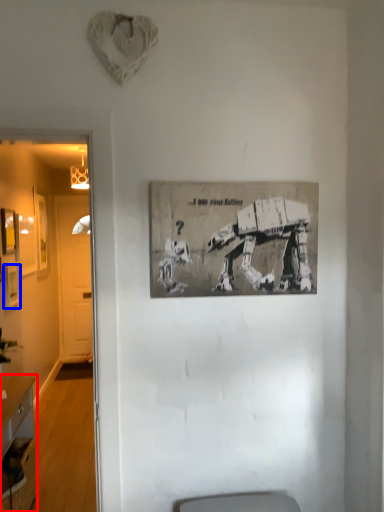
Question: Among these objects, which one is farthest to the camera, desk (highlighted by a red box) or picture frame (highlighted by a blue box)?

Choices:
 (A) desk
 (B) picture frame

Answer: (B)